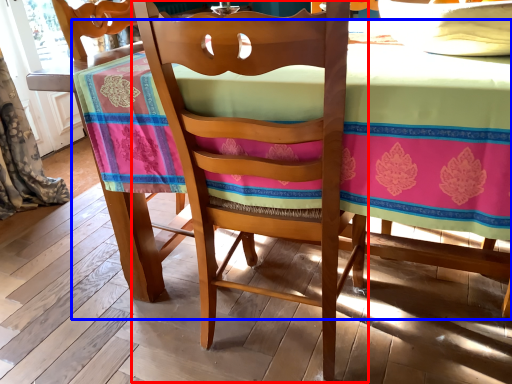
Question: Which of the following is the closest to the observer, chair (highlighted by a red box) or table (highlighted by a blue box)?

Choices:
 (A) chair
 (B) table

Answer: (B)